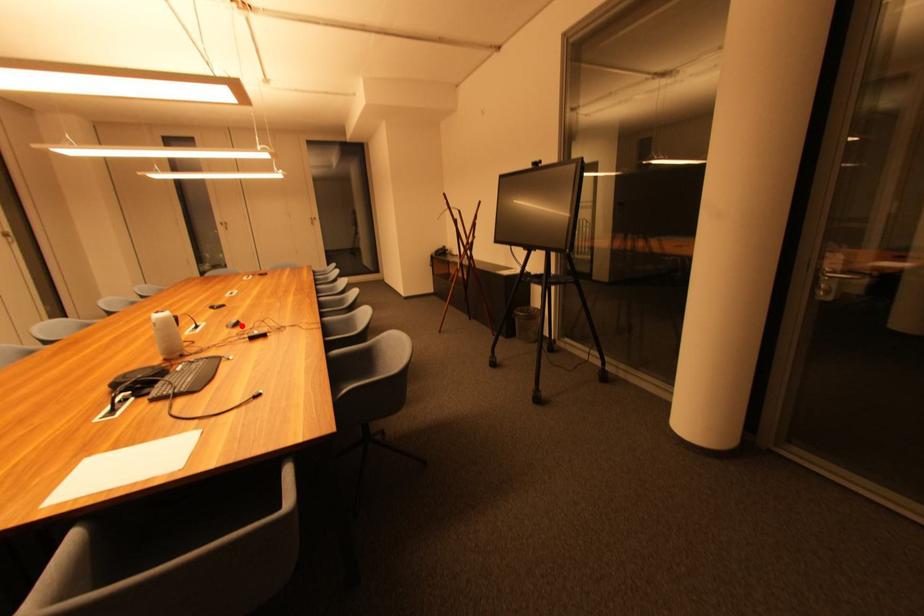
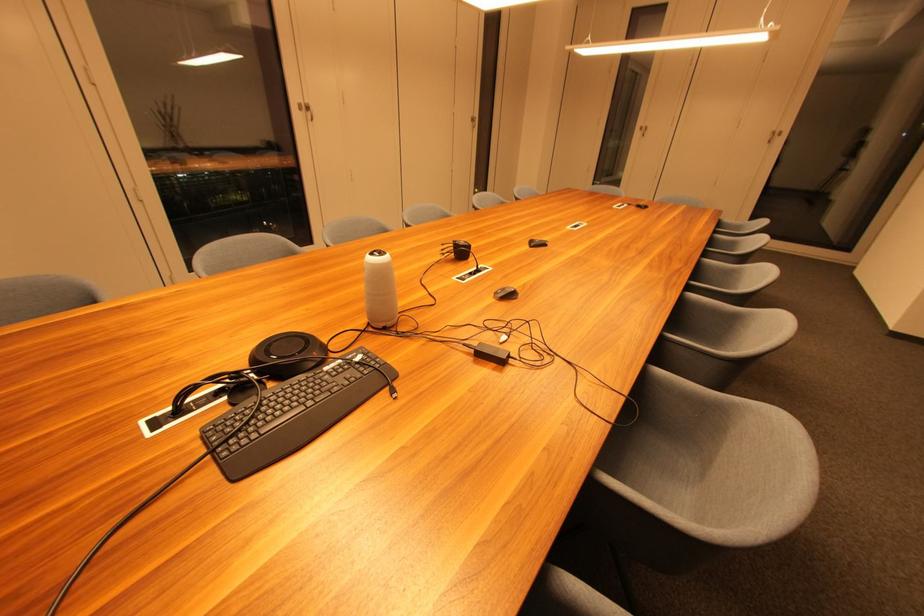
In the second image, find the point that corresponds to the highlighted location in the first image.

(515, 298)